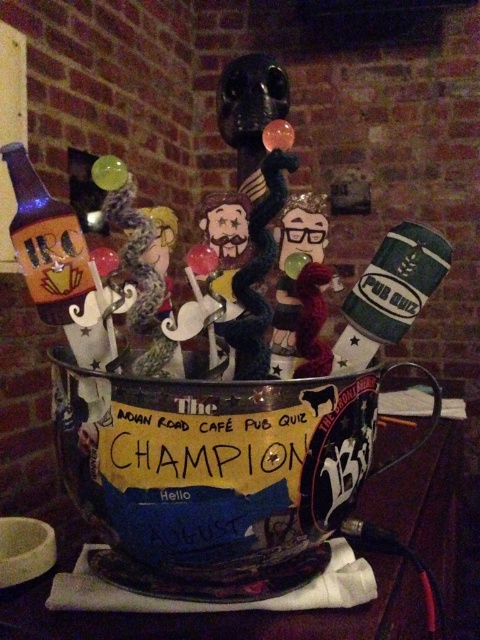
Question: Is metallic trophy at center positioned at the back of green matte cup at upper right?

Choices:
 (A) no
 (B) yes

Answer: (A)

Question: Considering the real-world distances, which object is farthest from the matte glass bottle at left?

Choices:
 (A) green matte cup at upper right
 (B) metallic trophy at center

Answer: (B)

Question: Which point appears closest to the camera in this image?

Choices:
 (A) (12, 243)
 (B) (422, 428)

Answer: (A)

Question: Does metallic trophy at center appear under green matte cup at upper right?

Choices:
 (A) yes
 (B) no

Answer: (A)

Question: Considering the relative positions of green matte cup at upper right and matte glass bottle at left in the image provided, where is green matte cup at upper right located with respect to matte glass bottle at left?

Choices:
 (A) right
 (B) left

Answer: (A)

Question: Which object is the farthest from the matte glass bottle at left?

Choices:
 (A) metallic trophy at center
 (B) green matte cup at upper right

Answer: (A)